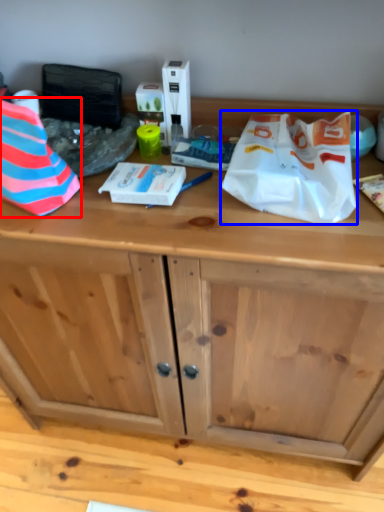
Question: Which object appears closest to the camera in this image, wrapping paper (highlighted by a red box) or wrapping paper (highlighted by a blue box)?

Choices:
 (A) wrapping paper
 (B) wrapping paper

Answer: (A)